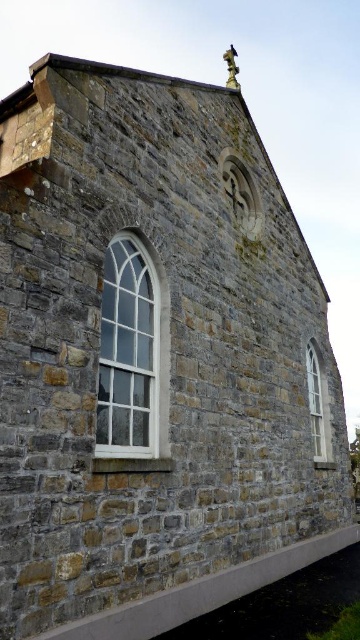
In the scene shown: Can you confirm if clear glass window at center is positioned to the right of white glass window at lower right?

In fact, clear glass window at center is to the left of white glass window at lower right.

Is point (155, 428) less distant than point (327, 451)?

Yes, it is.

Does point (101, 348) come in front of point (324, 408)?

Yes, point (101, 348) is closer to viewer.

Identify the location of clear glass window at center. This screenshot has width=360, height=640. [131, 353].